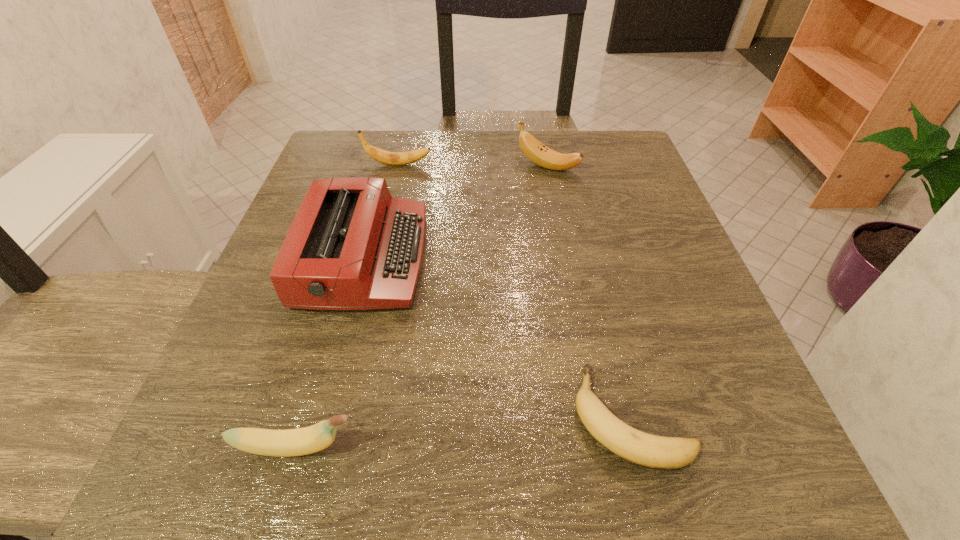
Locate an element on the screen. This screenshot has width=960, height=540. vacant position in the image that satisfies the following two spatial constraints: 1. on the back side of the shortest object; 2. on the typing side of the third farthest object is located at coordinates pyautogui.click(x=590, y=258).